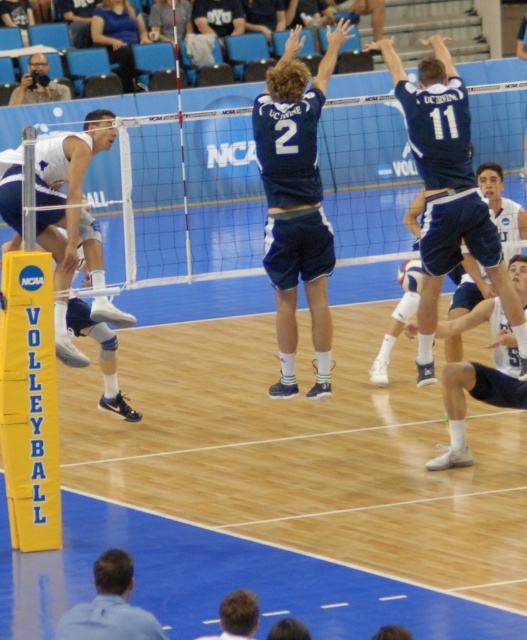
Question: Which point appears farthest from the camera in this image?

Choices:
 (A) (229, 609)
 (B) (417, 284)
 (C) (292, 164)

Answer: (B)

Question: Which point is closer to the camera taking this photo?

Choices:
 (A) (415, 154)
 (B) (96, 284)

Answer: (A)

Question: Which point is farther to the camera?

Choices:
 (A) (143, 621)
 (B) (464, 196)
 (C) (47, 68)

Answer: (C)

Question: In this image, where is white mesh net at center located relative to blue athletic shorts at lower right?

Choices:
 (A) right
 (B) left

Answer: (B)

Question: Does blue athletic shorts at lower right come behind brown hair at lower center?

Choices:
 (A) yes
 (B) no

Answer: (A)

Question: Where is black camera at upper left located in relation to white matte volleyball at center in the image?

Choices:
 (A) right
 (B) left

Answer: (B)